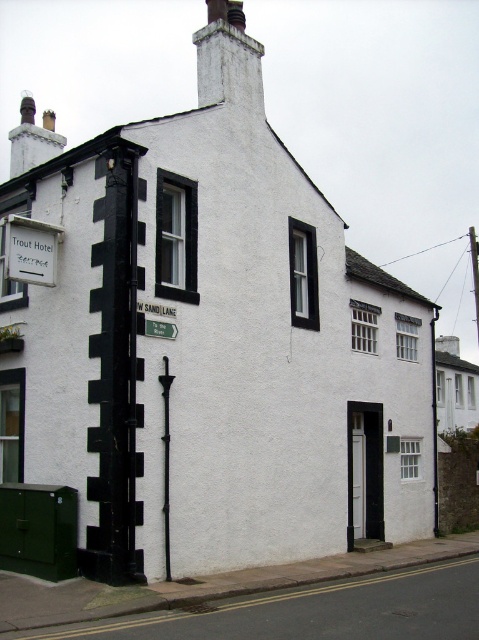
Is white painted brick chimney at upper center smaller than black metal pole at center?

Actually, white painted brick chimney at upper center might be larger than black metal pole at center.

Between white painted brick chimney at upper center and black metal pole at center, which one is positioned higher?

Positioned higher is white painted brick chimney at upper center.

Find the location of a particular element. This screenshot has width=479, height=640. white painted brick chimney at upper center is located at coordinates (228, 58).

Image resolution: width=479 pixels, height=640 pixels. What are the coordinates of `white painted brick chimney at upper center` in the screenshot? It's located at (228, 58).

Can you confirm if black metal pole at center is positioned to the right of green plastic street sign at lower left?

Yes, black metal pole at center is to the right of green plastic street sign at lower left.

Can you confirm if black metal pole at center is positioned above green plastic street sign at lower left?

No.

What are the coordinates of `black metal pole at center` in the screenshot? It's located at (166, 461).

Does white painted brick chimney at upper center have a lesser height compared to green plastic street sign at lower left?

Incorrect, white painted brick chimney at upper center's height does not fall short of green plastic street sign at lower left's.

What do you see at coordinates (228, 58) in the screenshot?
I see `white painted brick chimney at upper center` at bounding box center [228, 58].

Does point (216, 67) come closer to viewer compared to point (155, 333)?

No, (216, 67) is further to viewer.

The image size is (479, 640). I want to click on white painted brick chimney at upper center, so click(x=228, y=58).